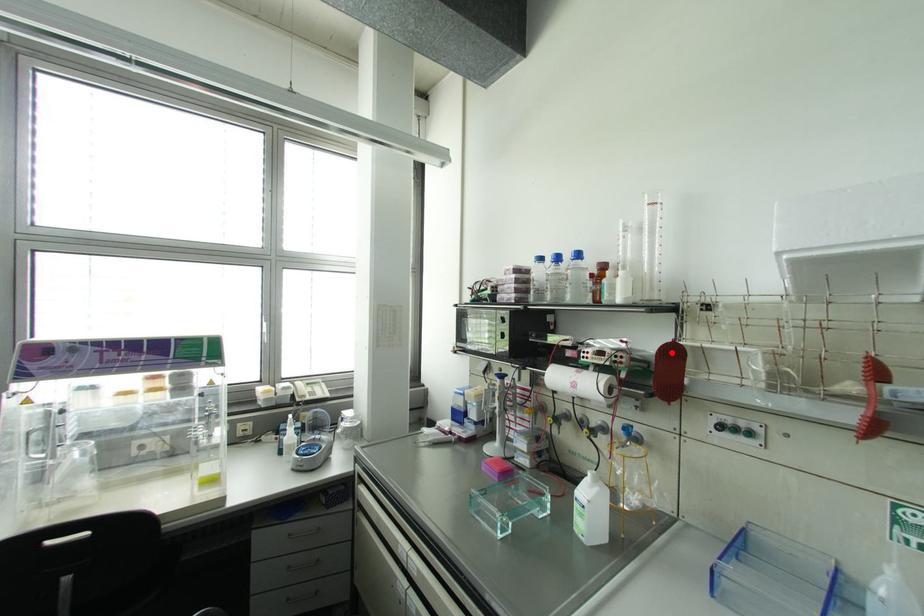
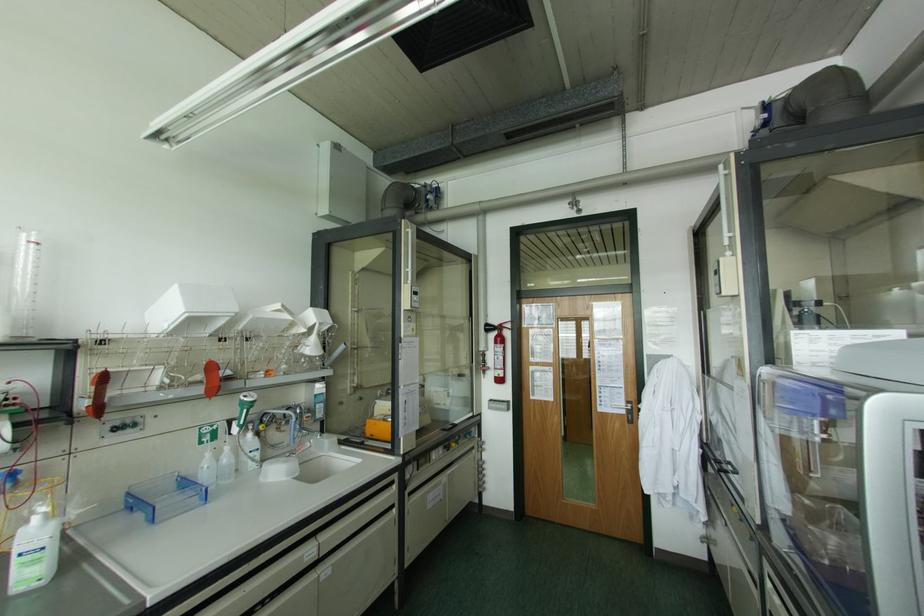
Question: A red point is marked in image1. In image2, is the corresponding 3D point closer to the camera or farther? Reply with the corresponding letter.

Choices:
 (A) The corresponding 3D point is closer.
 (B) The corresponding 3D point is farther.

Answer: (A)